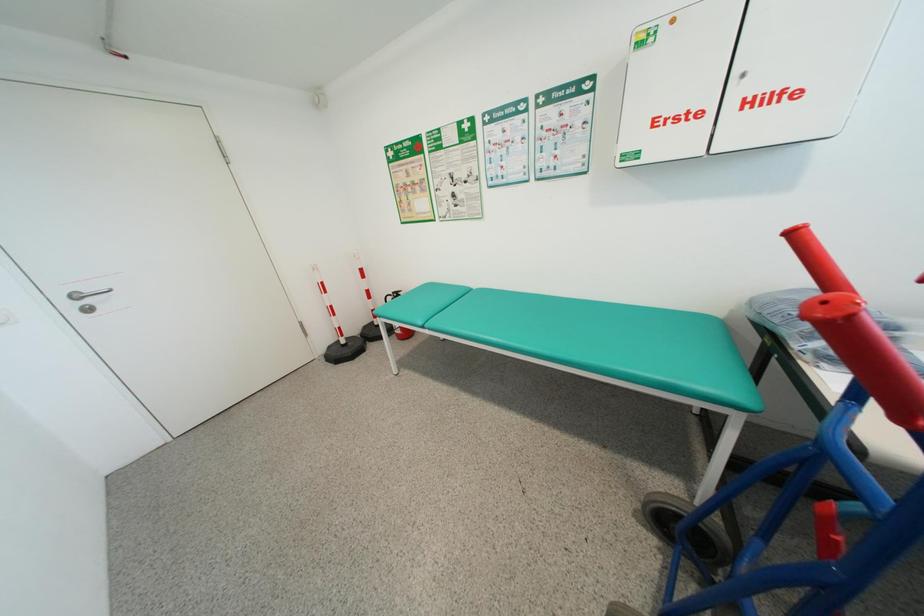
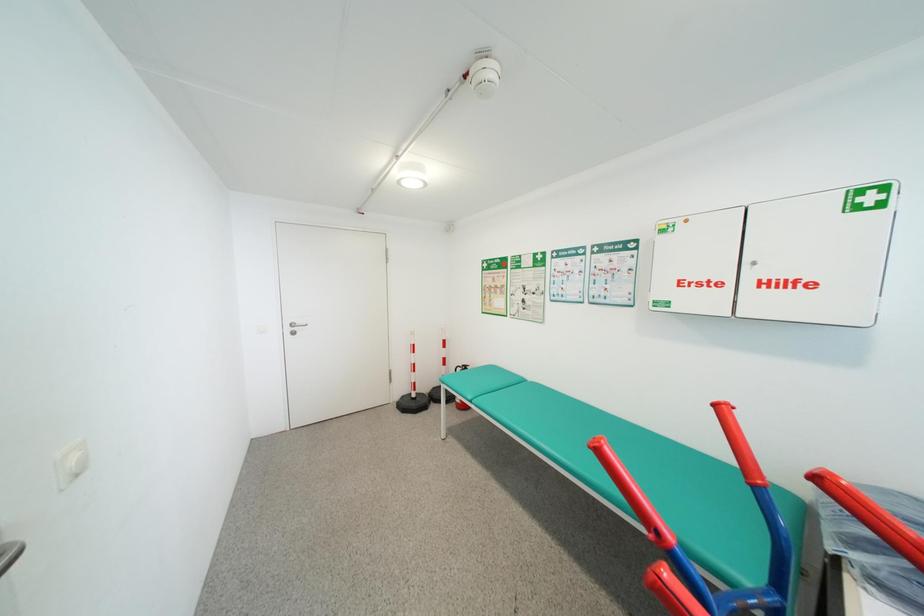
In a continuous first-person perspective shot, in which direction is the camera moving?

The movement direction of the cameraman is right, backward.